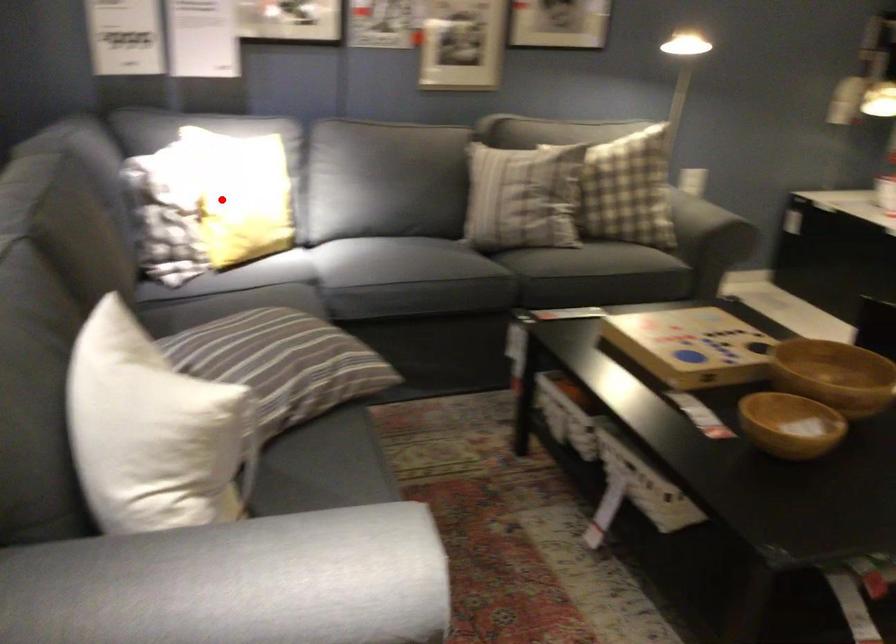
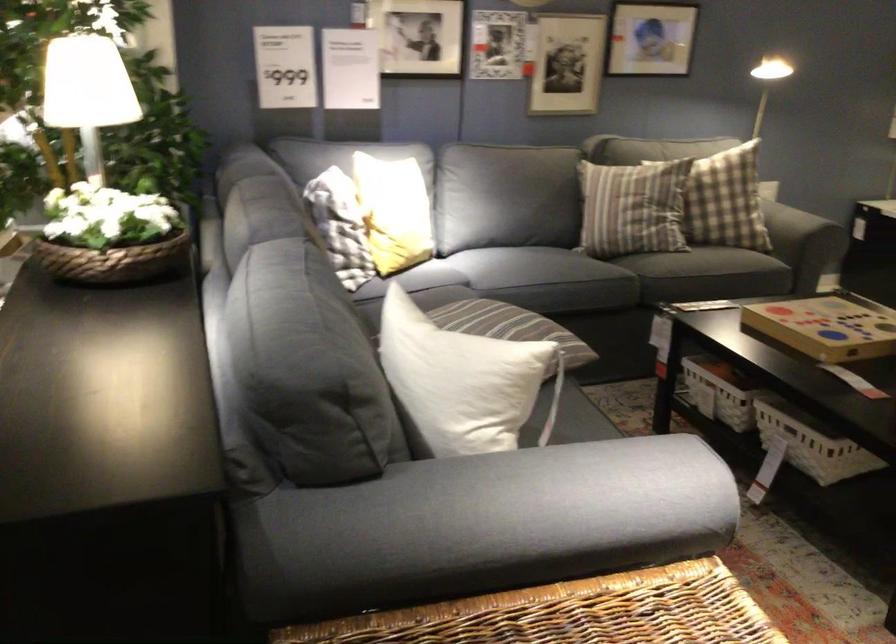
The point at the highlighted location is marked in the first image. Where is the corresponding point in the second image?

(392, 212)